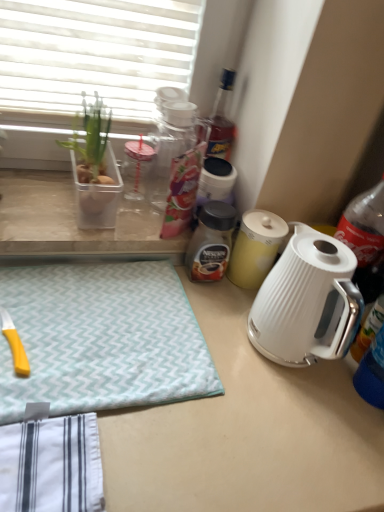
At what (x,y) coordinates should I click in order to perform the action: click on vacant space in white glossy electric kettle at center-right (from a real-world perspective). Please return your answer as a coordinate pair (x, y). The height and width of the screenshot is (512, 384). Looking at the image, I should click on (294, 371).